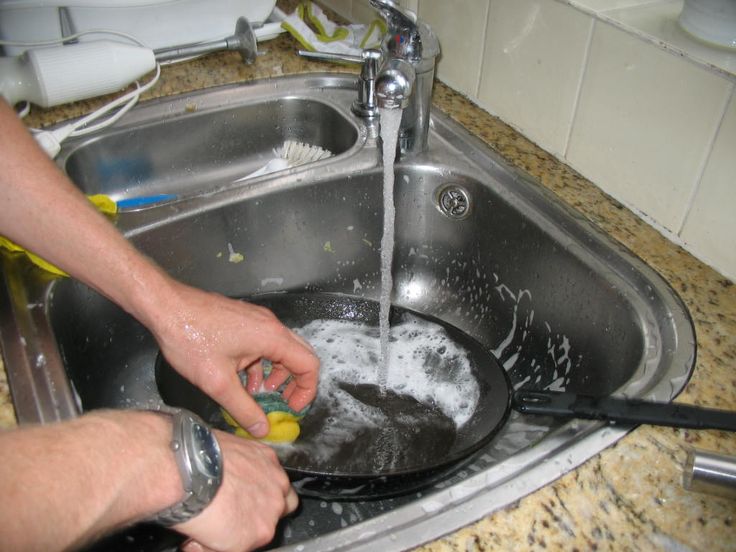
Find the location of a particular element. This screenshot has width=736, height=552. granite countertop is located at coordinates (634, 495), (600, 201), (188, 77).